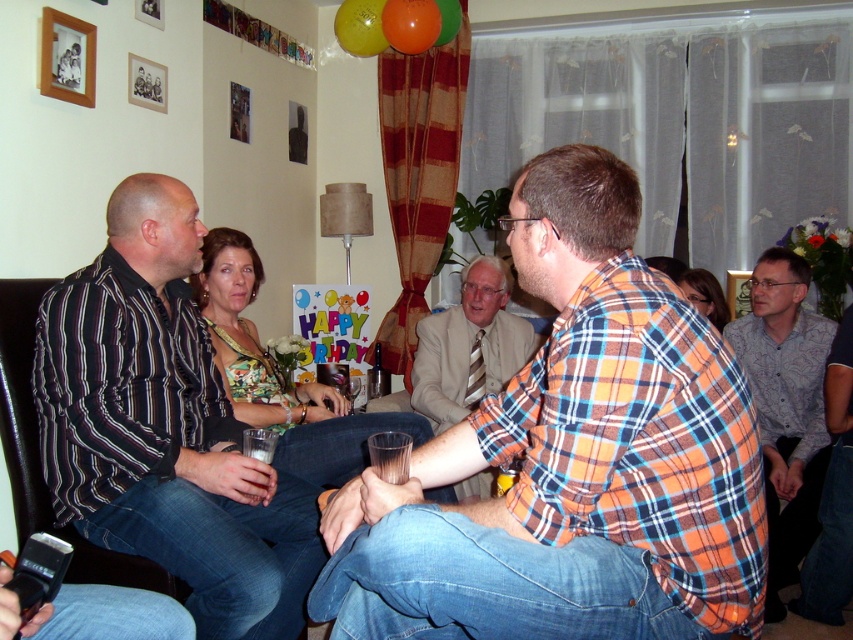
Question: In this image, where is floral print blouse at center located relative to plaid flannel shirt at center?

Choices:
 (A) right
 (B) left

Answer: (B)

Question: Can you confirm if striped cotton shirt at left is smaller than floral print blouse at center?

Choices:
 (A) no
 (B) yes

Answer: (B)

Question: Which point is closer to the camera taking this photo?

Choices:
 (A) (761, 342)
 (B) (416, 326)
 (C) (703, 276)

Answer: (A)

Question: Does gray cotton shirt at right have a lesser width compared to floral fabric dress at center?

Choices:
 (A) no
 (B) yes

Answer: (A)

Question: Which point is farther from the camera taking this photo?

Choices:
 (A) (202, 296)
 (B) (769, 394)
 (C) (688, 294)

Answer: (C)

Question: Considering the real-world distances, which object is closest to the orange plaid shirt at center?

Choices:
 (A) plaid flannel shirt at center
 (B) gray cotton shirt at right
 (C) striped cotton shirt at left
 (D) floral fabric dress at center

Answer: (C)